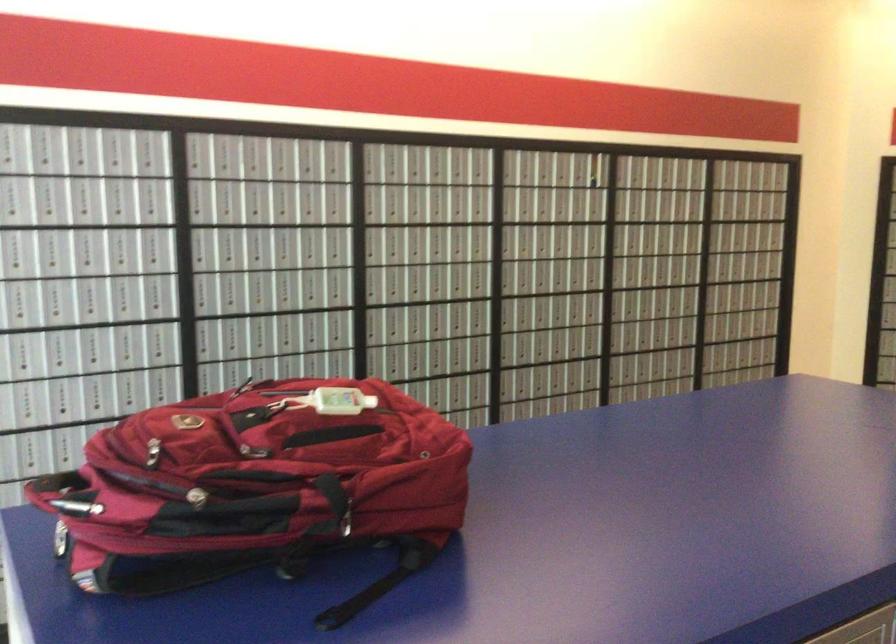
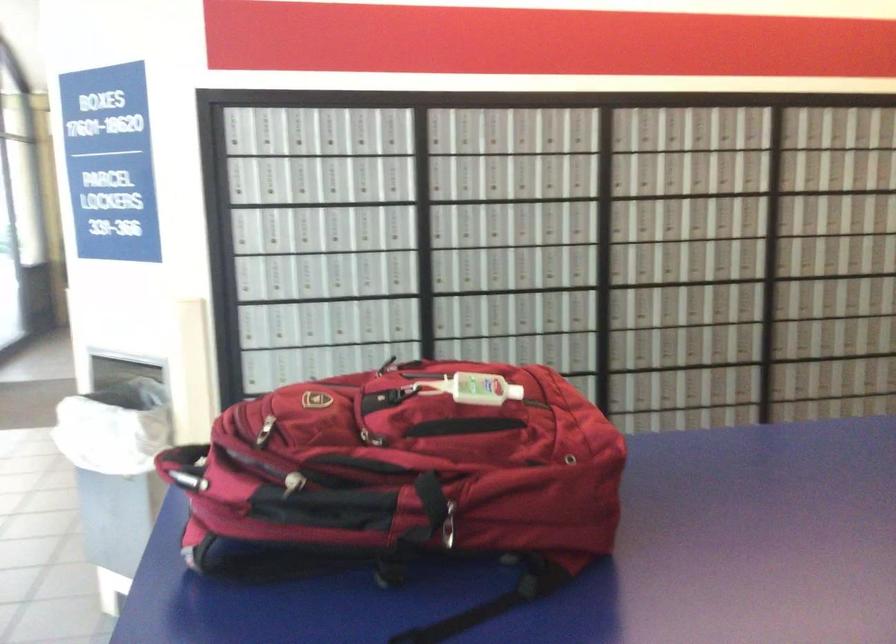
The point at (73, 494) is marked in the first image. Where is the corresponding point in the second image?

(185, 466)